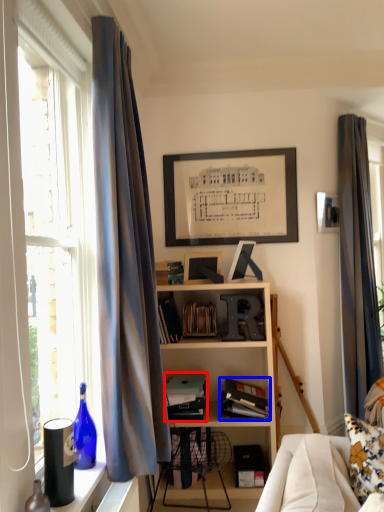
Question: Which object appears closest to the camera in this image, book (highlighted by a red box) or book (highlighted by a blue box)?

Choices:
 (A) book
 (B) book

Answer: (B)